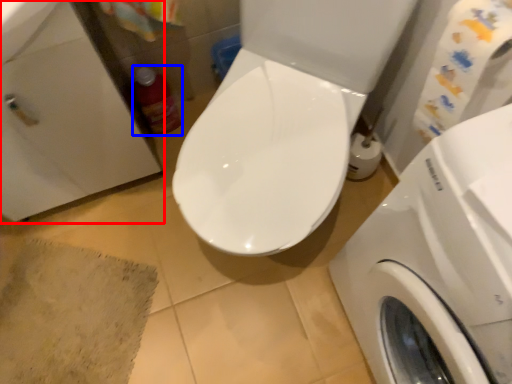
Question: Which object appears farthest to the camera in this image, sink (highlighted by a red box) or cleaning product (highlighted by a blue box)?

Choices:
 (A) sink
 (B) cleaning product

Answer: (B)